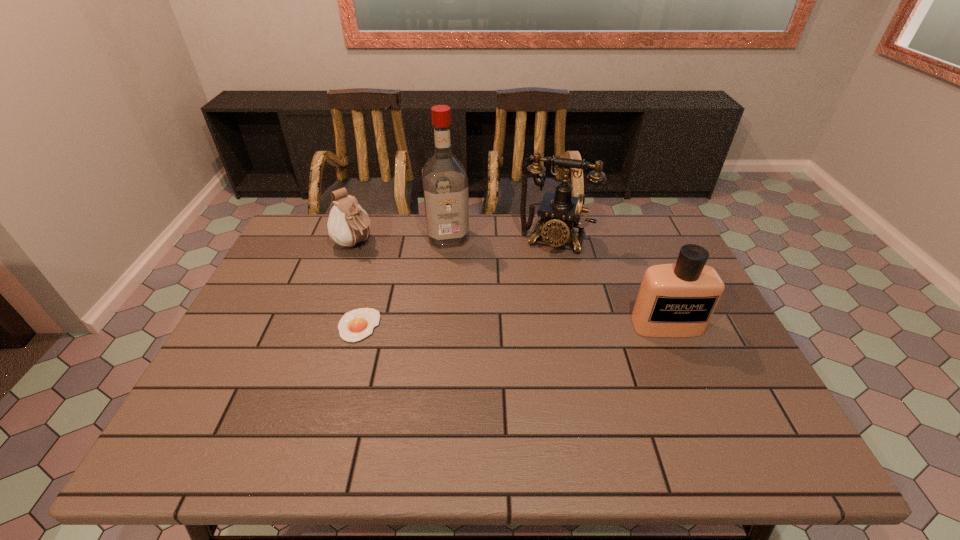
The height and width of the screenshot is (540, 960). Find the location of `free spot on the desktop that is between the egg yolk and the perfume and is positioned on the rotary dial of the fourth shortest object`. free spot on the desktop that is between the egg yolk and the perfume and is positioned on the rotary dial of the fourth shortest object is located at coordinates (528, 326).

Identify the location of vacant space on the desktop that is between the egg yolk and the perfume and is positioned on the front-facing side of the liquor. This screenshot has height=540, width=960. (468, 326).

This screenshot has width=960, height=540. In order to click on vacant space on the desktop that is between the egg yolk and the third shortest object and is positioned on the front-facing side of the pouch in this screenshot , I will do `click(477, 326)`.